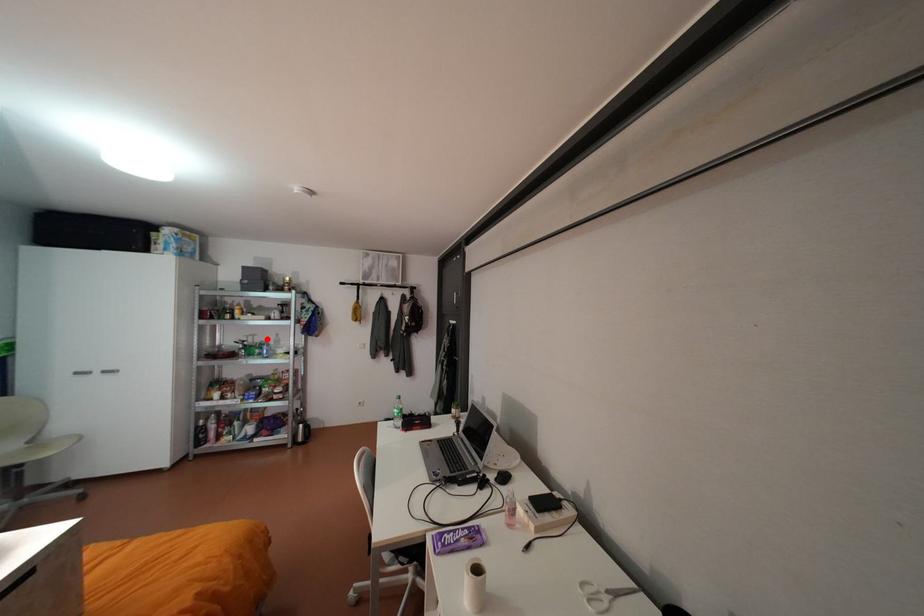
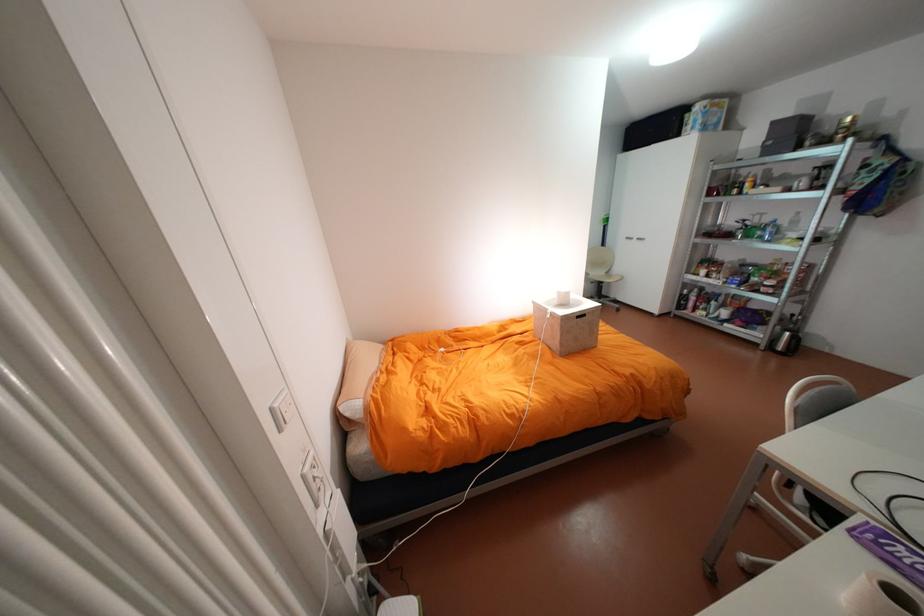
Find the pixel in the second image that matches the highlighted location in the first image.

(775, 219)